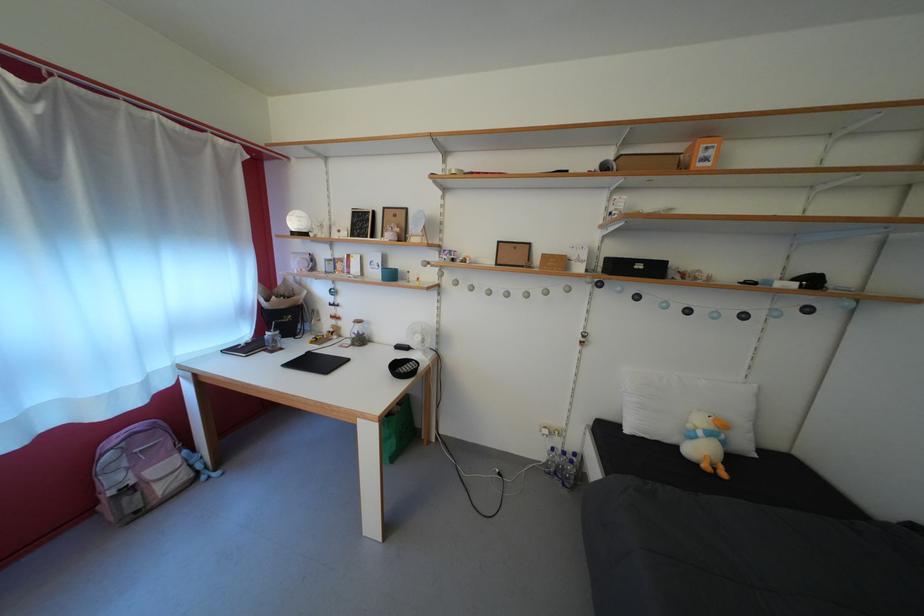
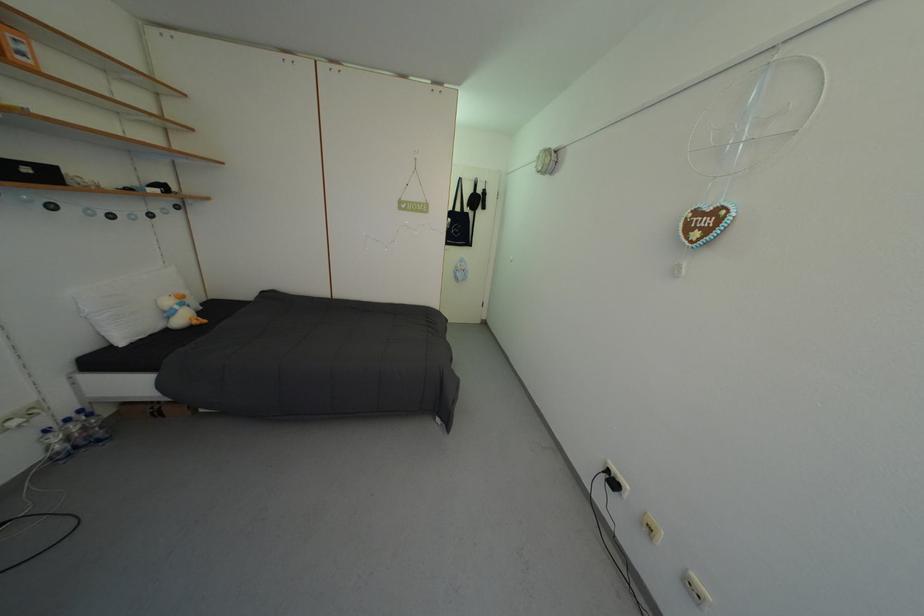
Find the pixel in the second image that matches (709,439) in the first image.

(186, 313)